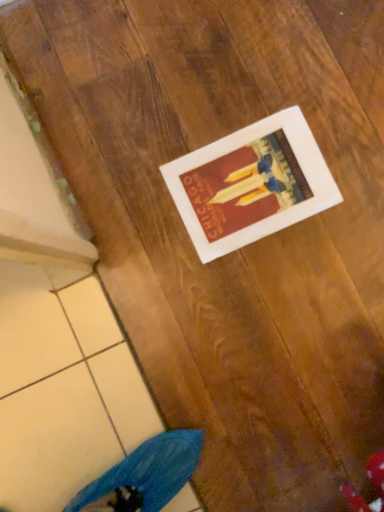
The height and width of the screenshot is (512, 384). In order to click on free space to the back side of white matte picture frame at center in this screenshot , I will do `click(192, 90)`.